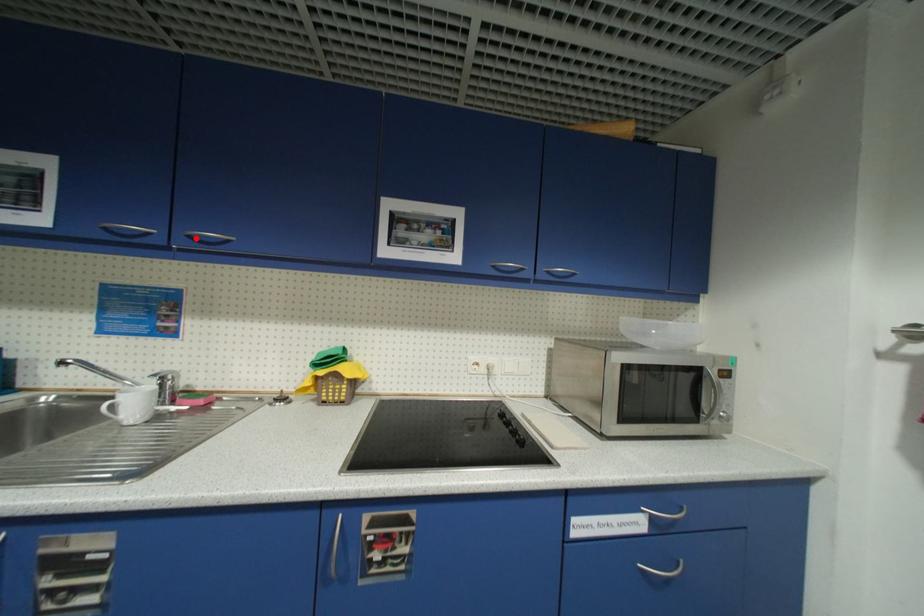
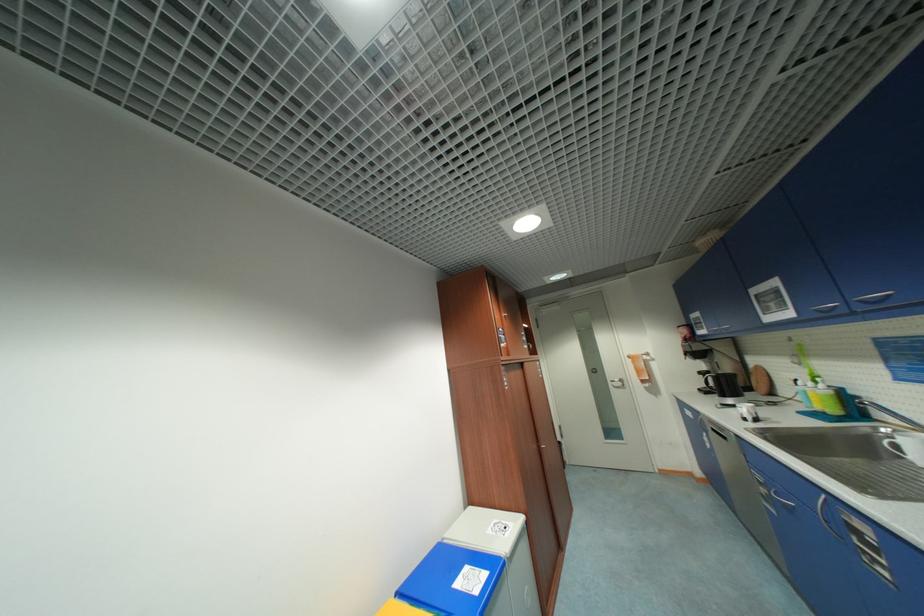
Question: A red point is marked in image1. In image2, is the corresponding 3D point closer to the camera or farther? Reply with the corresponding letter.

Choices:
 (A) The corresponding 3D point is closer.
 (B) The corresponding 3D point is farther.

Answer: (A)